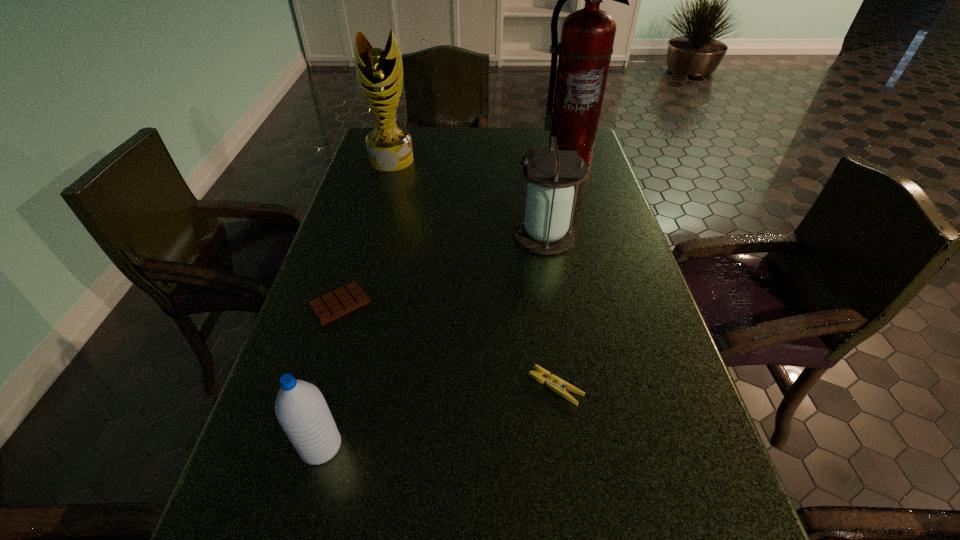
You are a GUI agent. You are given a task and a screenshot of the screen. Output one action in this format:
    pyautogui.click(x=<x>, y=<y>)
    Task: Click on the lantern at the right edge
    
    Given the screenshot: What is the action you would take?
    pyautogui.click(x=546, y=229)

Where is `object present at the far left corner`? object present at the far left corner is located at coordinates (379, 72).

Identify the location of object at the far right corner. (587, 38).

This screenshot has height=540, width=960. Identify the location of free space at the far edge of the desktop. (517, 139).

In the image, there is a desktop. Identify the location of vacant space at the left edge. Image resolution: width=960 pixels, height=540 pixels. (351, 262).

In the image, there is a desktop. Where is `free region at the right edge`? The width and height of the screenshot is (960, 540). free region at the right edge is located at coordinates (654, 307).

At what (x,y) coordinates should I click in order to perform the action: click on vacant region at the far left corner. Please return your answer as a coordinate pair (x, y). Image resolution: width=960 pixels, height=540 pixels. Looking at the image, I should click on (407, 127).

Where is `free spot between the award and the clothespin`? free spot between the award and the clothespin is located at coordinates pos(473,273).

Identify the location of vacant space in between the lantern and the second tallest object. (468, 198).

At what (x,y) coordinates should I click in order to perform the action: click on vacant space that's between the clothespin and the fire extinguisher. Please return your answer as a coordinate pair (x, y). Image resolution: width=960 pixels, height=540 pixels. Looking at the image, I should click on (562, 272).